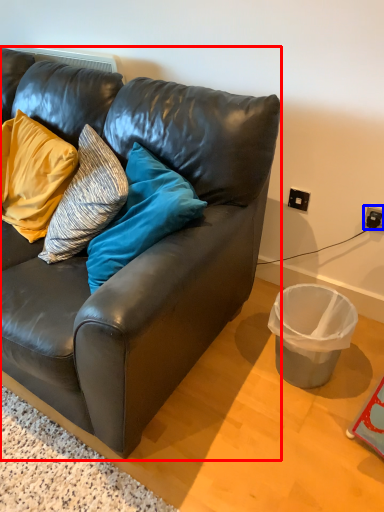
Question: Which point is further to the camera, studio couch (highlighted by a red box) or power outlet (highlighted by a blue box)?

Choices:
 (A) studio couch
 (B) power outlet

Answer: (B)